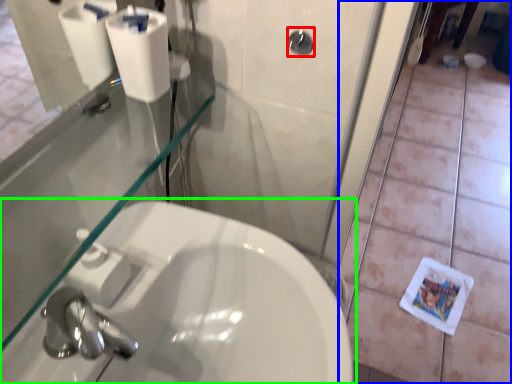
Question: Which object is the closest to the shower (highlighted by a red box)? Choose among these: tile (highlighted by a blue box) or sink (highlighted by a green box).

Choices:
 (A) tile
 (B) sink

Answer: (B)